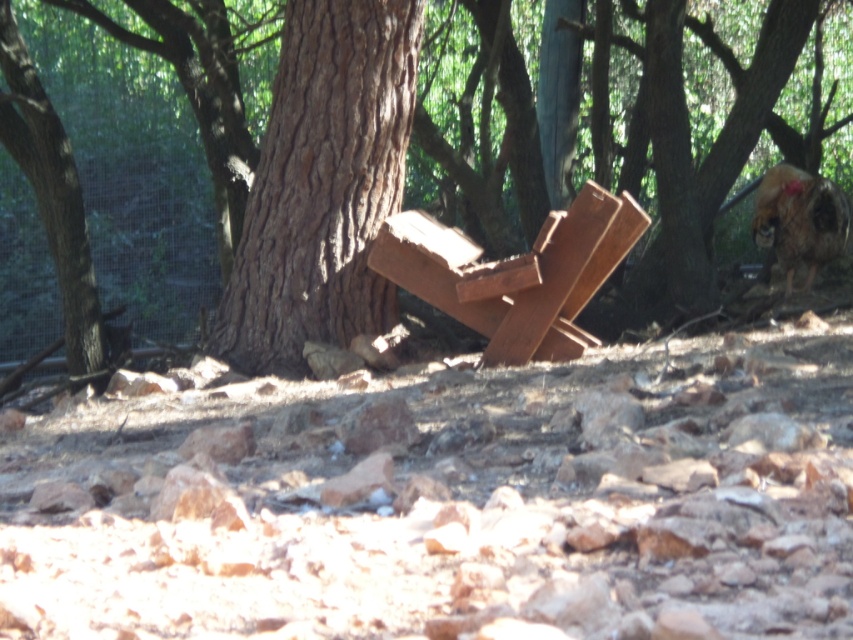
You are navigating through the wooded area and need to reach a destination located at the position of point (x=787, y=48). You are currently at point (x=352, y=216). Based on the terrain described, which direction should you move to get closer to your destination?

Since point (x=787, y=48) is behind point (x=352, y=216), you should move in the direction away from your current position to reach the destination.

Consider the image. You are standing at the origin point in the scene. Where is the brown rough bark tree at center located in terms of coordinates?

The brown rough bark tree at center is located at coordinates point (322, 184).